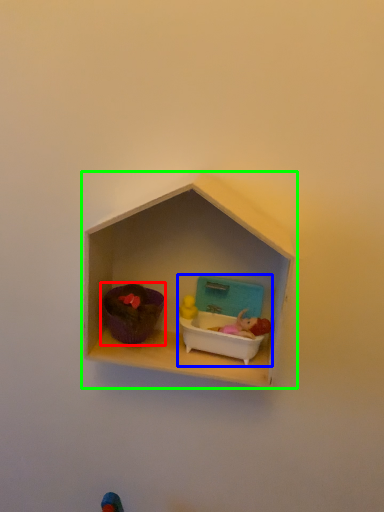
Question: Considering the real-world distances, which object is farthest from toy (highlighted by a red box)? toy (highlighted by a blue box) or shelf (highlighted by a green box)?

Choices:
 (A) toy
 (B) shelf

Answer: (B)